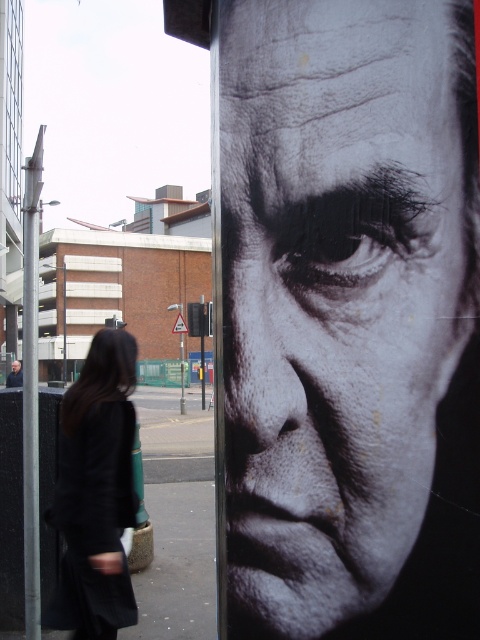
Is black matte face at center shorter than smooth skin face at center?

No.

Does black matte face at center have a greater height compared to smooth skin face at center?

Yes, black matte face at center is taller than smooth skin face at center.

Is point (399, 467) positioned after point (15, 380)?

No, it is in front of (15, 380).

Where is `black matte face at center`? black matte face at center is located at coordinates (346, 317).

Is black fabric coat at lower left further to the viewer compared to smooth skin face at center?

No, it is not.

Who is taller, black fabric coat at lower left or smooth skin face at center?

Standing taller between the two is black fabric coat at lower left.

Describe the element at coordinates (96, 492) in the screenshot. Image resolution: width=480 pixels, height=640 pixels. I see `black fabric coat at lower left` at that location.

This screenshot has width=480, height=640. Find the location of `black fabric coat at lower left`. black fabric coat at lower left is located at coordinates (96, 492).

Is point (337, 380) behind point (132, 502)?

No, (337, 380) is closer to viewer.

Looking at this image, is black matte face at center closer to the viewer compared to black fabric coat at lower left?

Yes.

Identify the location of black matte face at center. (346, 317).